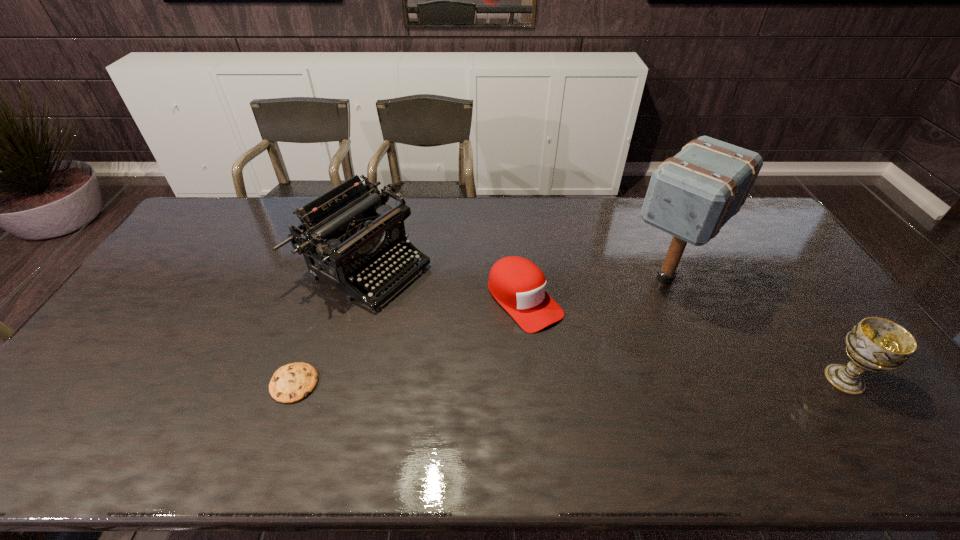
This screenshot has height=540, width=960. In order to click on vacant spot on the desktop that is between the cookie and the rightmost object and is positioned on the keyboard of the second tallest object in this screenshot , I will do `click(587, 381)`.

This screenshot has height=540, width=960. Identify the location of vacant spot on the desktop that is between the shortest object and the rightmost object and is positioned on the front-facing side of the fourth tallest object. (602, 381).

This screenshot has height=540, width=960. What are the coordinates of `free space on the desktop that is between the cookie and the rightmost object and is positioned on the striking surface of the fourth object from left to right` in the screenshot? It's located at (566, 381).